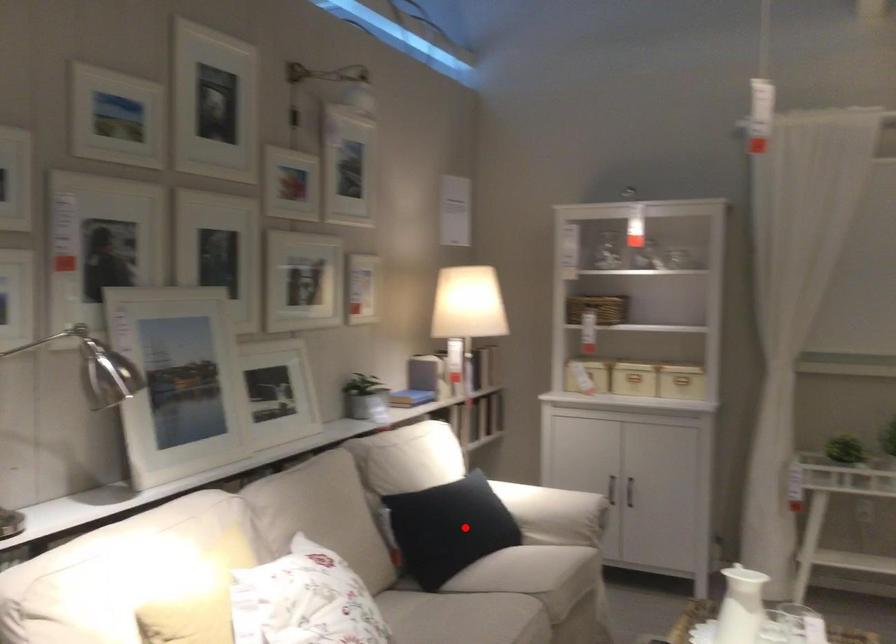
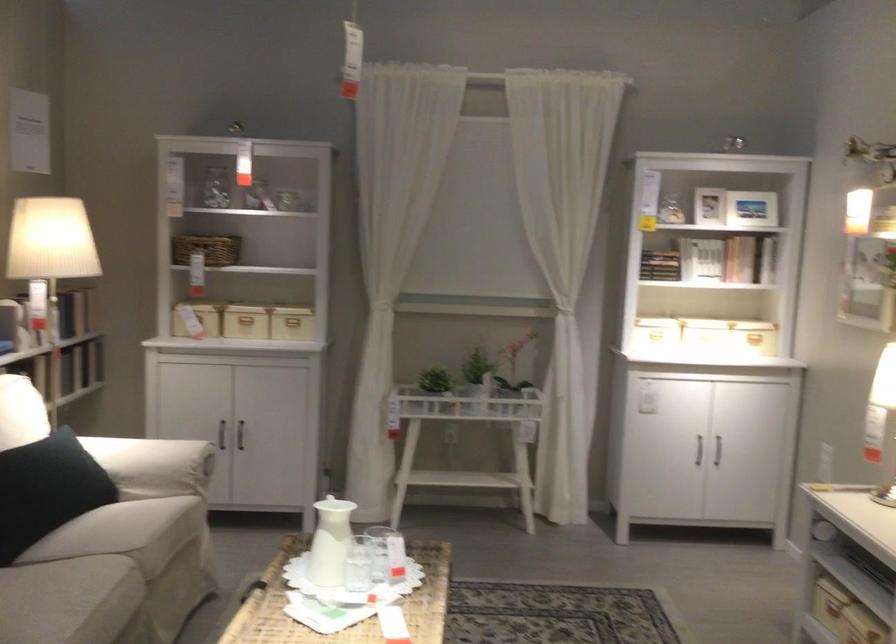
Question: I am providing you with two images of the same scene from different viewpoints. Image1 has a red point marked. In image2, the corresponding 3D location appears at what relative position? Reply with the corresponding letter.

Choices:
 (A) Closer
 (B) Farther

Answer: (A)